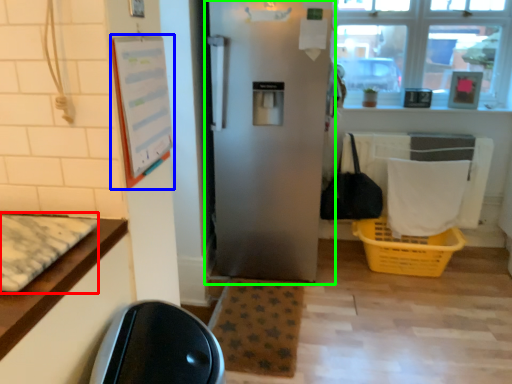
Question: Estimate the real-world distances between objects in this image. Which object is closer to mat (highlighted by a red box), bulletin board (highlighted by a blue box) or refrigerator (highlighted by a green box)?

Choices:
 (A) bulletin board
 (B) refrigerator

Answer: (A)